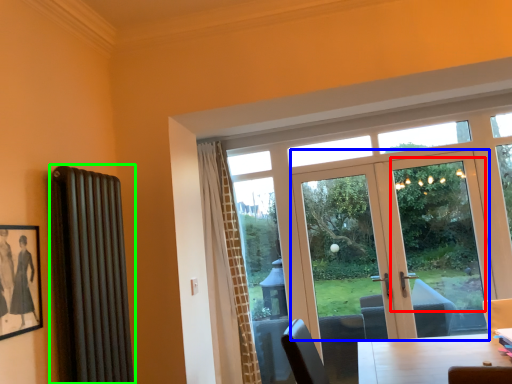
Question: Which object is positioned closest to window screen (highlighted by a red box)? Select from door (highlighted by a blue box) and radiator (highlighted by a green box).

Choices:
 (A) door
 (B) radiator

Answer: (A)